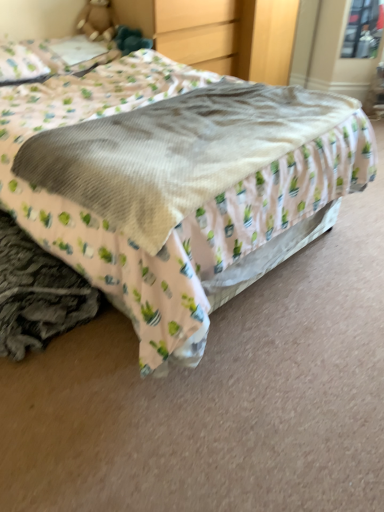
What do you see at coordinates (363, 29) in the screenshot? I see `transparent glass window at upper right` at bounding box center [363, 29].

This screenshot has height=512, width=384. Find the location of `matte wood dresser at upper center`. matte wood dresser at upper center is located at coordinates (219, 33).

Image resolution: width=384 pixels, height=512 pixels. Find the location of `white fabric pillow at upper left`. white fabric pillow at upper left is located at coordinates (20, 65).

Looking at their sizes, would you say soft beige blanket at center is wider or thinner than matte wood dresser at upper center?

Considering their sizes, soft beige blanket at center looks broader than matte wood dresser at upper center.

Is soft beige blanket at center facing towards matte wood dresser at upper center?

No.

Is soft beige blanket at center shorter than matte wood dresser at upper center?

Correct, soft beige blanket at center is not as tall as matte wood dresser at upper center.

Is soft beige blanket at center surrounding matte wood dresser at upper center?

No, matte wood dresser at upper center is not surrounded by soft beige blanket at center.

Is white fabric pillow at upper left inside matte wood dresser at upper center?

Definitely not — white fabric pillow at upper left is not inside matte wood dresser at upper center.

Can you confirm if matte wood dresser at upper center is taller than white fabric pillow at upper left?

Yes, matte wood dresser at upper center is taller than white fabric pillow at upper left.

Between matte wood dresser at upper center and white fabric pillow at upper left, which one has smaller size?

white fabric pillow at upper left.

Can you confirm if matte wood dresser at upper center is thinner than white fabric pillow at upper left?

Incorrect, the width of matte wood dresser at upper center is not less than that of white fabric pillow at upper left.

Between soft beige blanket at center and transparent glass window at upper right, which one appears on the right side from the viewer's perspective?

Positioned to the right is transparent glass window at upper right.

Find the location of a particular element. The height and width of the screenshot is (512, 384). mattress on the left side of transparent glass window at upper right is located at coordinates (208, 163).

Between soft beige blanket at center and transparent glass window at upper right, which one has larger width?

soft beige blanket at center.

Are transparent glass window at upper right and soft beige blanket at center located far from each other?

Absolutely, transparent glass window at upper right is distant from soft beige blanket at center.

What's the angular difference between transparent glass window at upper right and soft beige blanket at center's facing directions?

They differ by 44.3 degrees in their facing directions.

Is transparent glass window at upper right positioned with its back to soft beige blanket at center?

No, transparent glass window at upper right's orientation is not away from soft beige blanket at center.

Locate an element on the screen. window behind the soft beige blanket at center is located at coordinates (363, 29).

In terms of height, does matte wood dresser at upper center look taller or shorter compared to transparent glass window at upper right?

Clearly, matte wood dresser at upper center is taller compared to transparent glass window at upper right.

Is matte wood dresser at upper center in front of or behind transparent glass window at upper right in the image?

Visually, matte wood dresser at upper center is located in front of transparent glass window at upper right.

In the scene shown: Is matte wood dresser at upper center facing towards transparent glass window at upper right?

No.

Looking at this image, would you say matte wood dresser at upper center is to the left or to the right of transparent glass window at upper right in the picture?

matte wood dresser at upper center is to the left of transparent glass window at upper right.

Looking at this image, is matte wood dresser at upper center oriented towards soft beige blanket at center?

No, matte wood dresser at upper center is not facing towards soft beige blanket at center.

Does matte wood dresser at upper center have a lesser width compared to soft beige blanket at center?

Correct, the width of matte wood dresser at upper center is less than that of soft beige blanket at center.

You are a GUI agent. You are given a task and a screenshot of the screen. Output one action in this format:
    pyautogui.click(x=<x>, y=<y>)
    Task: Click on the dresser that appears on the left of soft beige blanket at center
    
    Given the screenshot: What is the action you would take?
    point(219,33)

From their relative heights in the image, would you say matte wood dresser at upper center is taller or shorter than soft beige blanket at center?

Considering their sizes, matte wood dresser at upper center has more height than soft beige blanket at center.

Is point (21, 82) farther from camera compared to point (355, 19)?

That is False.

Based on the photo, is white fabric pillow at upper left closer to camera compared to transparent glass window at upper right?

Yes, it is in front of transparent glass window at upper right.

Considering the sizes of objects white fabric pillow at upper left and transparent glass window at upper right in the image provided, who is thinner, white fabric pillow at upper left or transparent glass window at upper right?

transparent glass window at upper right.

Is white fabric pillow at upper left not inside transparent glass window at upper right?

Yes, white fabric pillow at upper left is located beyond the bounds of transparent glass window at upper right.

At what (x,y) coordinates should I click in order to perform the action: click on mattress that is in front of the matte wood dresser at upper center. Please return your answer as a coordinate pair (x, y). This screenshot has height=512, width=384. Looking at the image, I should click on (208, 163).

This screenshot has height=512, width=384. What are the coordinates of `pillow on the left of the matte wood dresser at upper center` in the screenshot? It's located at (20, 65).

Estimate the real-world distances between objects in this image. Which object is closer to transparent glass window at upper right, matte wood dresser at upper center or soft beige blanket at center?

matte wood dresser at upper center is positioned closer to the anchor transparent glass window at upper right.

Looking at the image, which one is located closer to soft beige blanket at center, white fabric pillow at upper left or matte wood dresser at upper center?

Among the two, white fabric pillow at upper left is located nearer to soft beige blanket at center.

Estimate the real-world distances between objects in this image. Which object is further from transparent glass window at upper right, white fabric pillow at upper left or matte wood dresser at upper center?

white fabric pillow at upper left.

Based on their spatial positions, is white fabric pillow at upper left or soft beige blanket at center closer to matte wood dresser at upper center?

white fabric pillow at upper left.

From the image, which object appears to be nearer to white fabric pillow at upper left, transparent glass window at upper right or soft beige blanket at center?

Based on the image, soft beige blanket at center appears to be nearer to white fabric pillow at upper left.

Estimate the real-world distances between objects in this image. Which object is further from white fabric pillow at upper left, soft beige blanket at center or transparent glass window at upper right?

The object further to white fabric pillow at upper left is transparent glass window at upper right.

Estimate the real-world distances between objects in this image. Which object is closer to white fabric pillow at upper left, matte wood dresser at upper center or transparent glass window at upper right?

matte wood dresser at upper center lies closer to white fabric pillow at upper left than the other object.

Based on their spatial positions, is soft beige blanket at center or matte wood dresser at upper center further from white fabric pillow at upper left?

soft beige blanket at center.

Where is `pillow between soft beige blanket at center and matte wood dresser at upper center along the z-axis`? The height and width of the screenshot is (512, 384). pillow between soft beige blanket at center and matte wood dresser at upper center along the z-axis is located at coordinates (20, 65).

Locate an element on the screen. This screenshot has width=384, height=512. mattress between white fabric pillow at upper left and transparent glass window at upper right from left to right is located at coordinates (208, 163).

Locate an element on the screen. Image resolution: width=384 pixels, height=512 pixels. dresser positioned between soft beige blanket at center and transparent glass window at upper right from near to far is located at coordinates (219, 33).

The image size is (384, 512). In order to click on dresser located between white fabric pillow at upper left and transparent glass window at upper right in the left-right direction in this screenshot , I will do `click(219, 33)`.